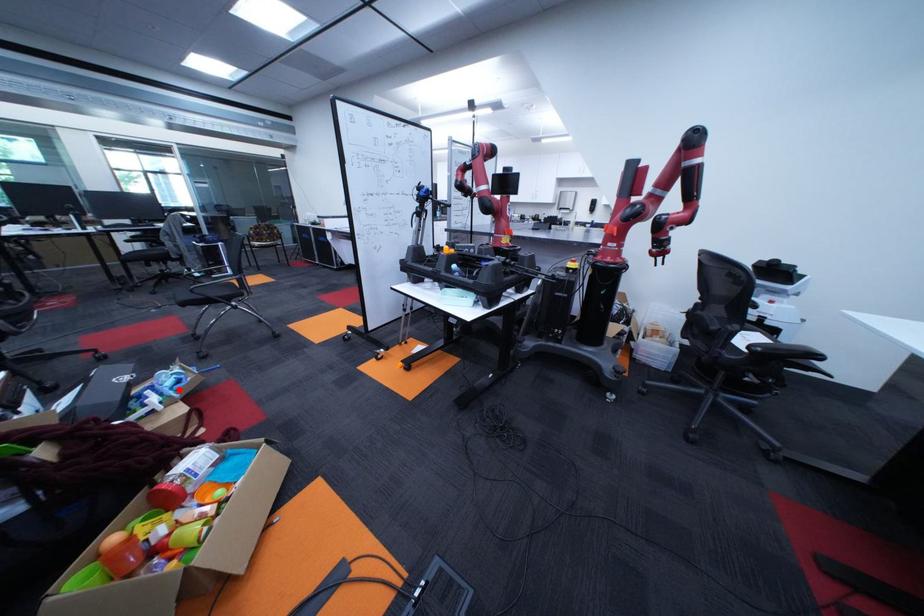
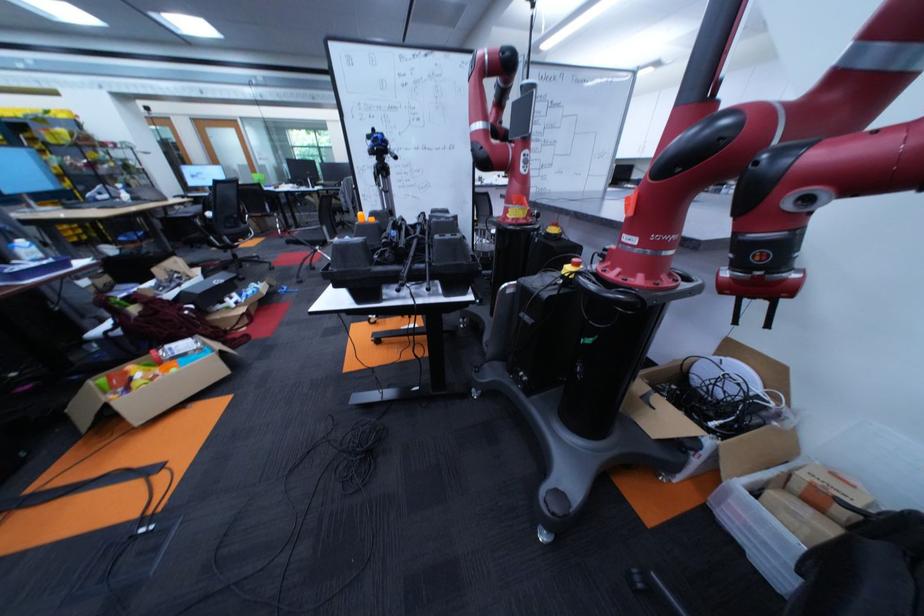
Question: A red point is marked in image1. In image2, is the corresponding 3D point closer to the camera or farther? Reply with the corresponding letter.

Choices:
 (A) The corresponding 3D point is closer.
 (B) The corresponding 3D point is farther.

Answer: (A)